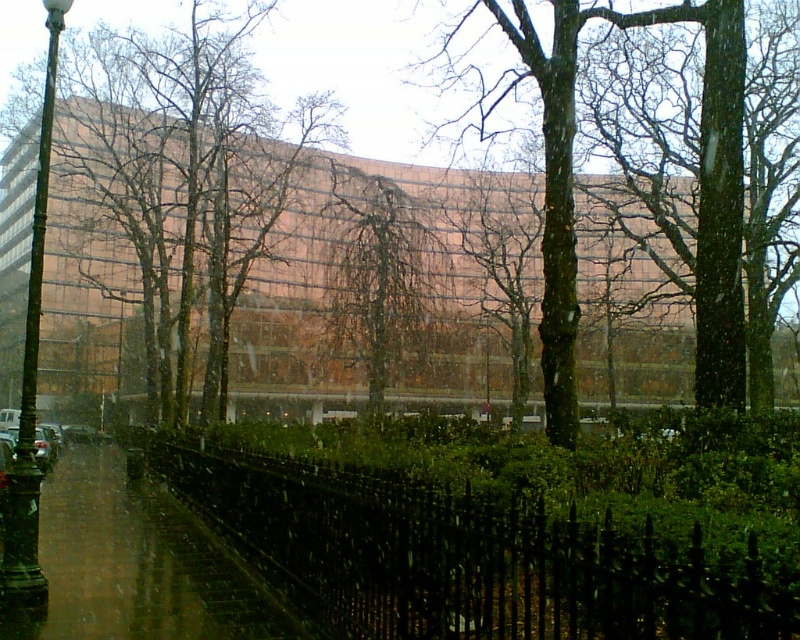
Question: Which point is closer to the camera?

Choices:
 (A) brown smooth tree at center
 (B) green leafy tree at center

Answer: (A)

Question: Which point is closer to the camera?

Choices:
 (A) (384, 189)
 (B) (702, 204)

Answer: (B)

Question: Can you confirm if brown/glassy tree at center is bigger than brown/mossy tree at center?

Choices:
 (A) yes
 (B) no

Answer: (A)

Question: Where is brown/glassy tree at center located in relation to brown smooth tree at center in the image?

Choices:
 (A) right
 (B) left

Answer: (B)

Question: Which point is farther from the camera taking this photo?

Choices:
 (A) (400, 323)
 (B) (122, 262)
 (C) (716, 304)
 (D) (562, 28)

Answer: (B)

Question: Is brown/glassy tree at center above brown/mossy tree at center?

Choices:
 (A) yes
 (B) no

Answer: (A)